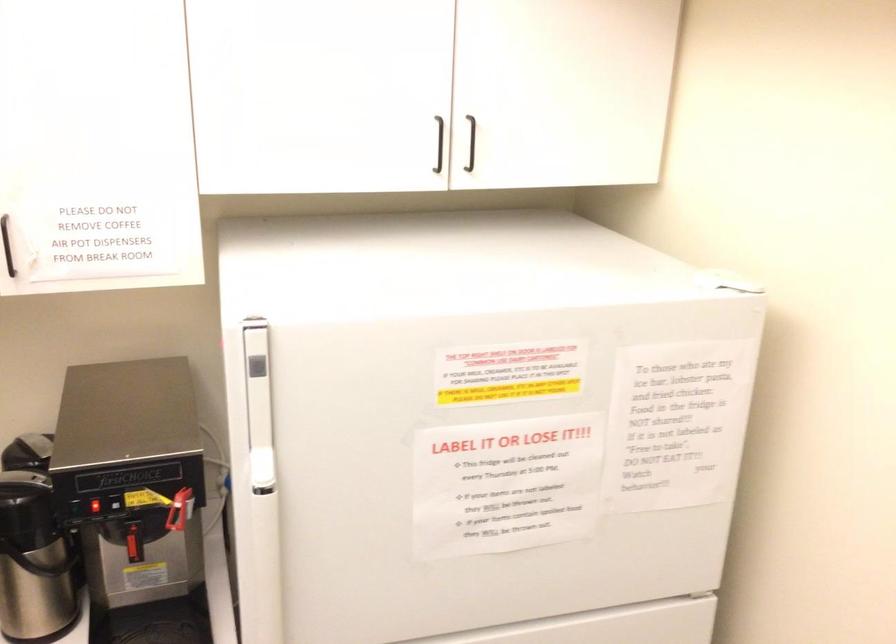
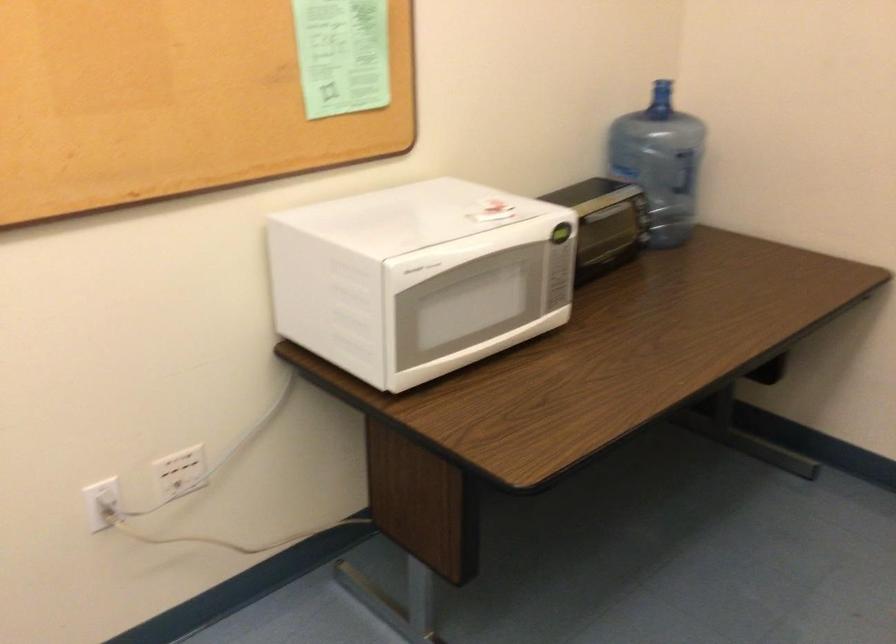
The first image is from the beginning of the video and the second image is from the end. How did the camera likely rotate when shooting the video?

The camera's rotation is toward right-down.